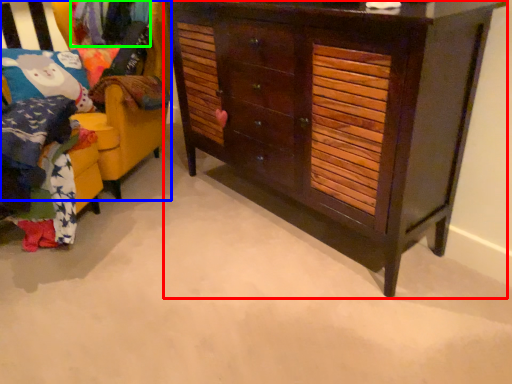
Question: Considering the real-world distances, which object is closest to chest of drawers (highlighted by a red box)? furniture (highlighted by a blue box) or clothing (highlighted by a green box).

Choices:
 (A) furniture
 (B) clothing

Answer: (A)